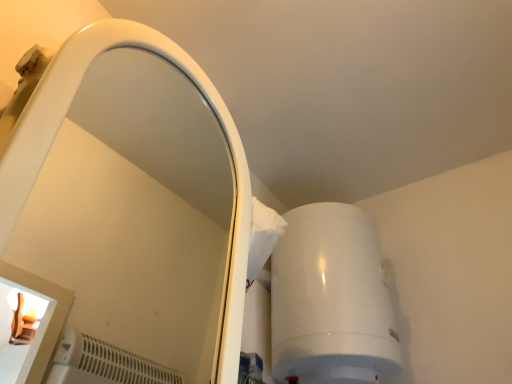
Question: Is white glossy mirror at upper left to the right of white glossy water heater at upper right from the viewer's perspective?

Choices:
 (A) yes
 (B) no

Answer: (B)

Question: Can we say white glossy mirror at upper left lies outside white glossy water heater at upper right?

Choices:
 (A) yes
 (B) no

Answer: (A)

Question: Is white glossy mirror at upper left in contact with white glossy water heater at upper right?

Choices:
 (A) no
 (B) yes

Answer: (A)

Question: Considering the relative sizes of white glossy mirror at upper left and white glossy water heater at upper right in the image provided, is white glossy mirror at upper left shorter than white glossy water heater at upper right?

Choices:
 (A) yes
 (B) no

Answer: (B)

Question: Is white glossy mirror at upper left taller than white glossy water heater at upper right?

Choices:
 (A) no
 (B) yes

Answer: (B)

Question: Is there a large distance between white glossy mirror at upper left and white glossy water heater at upper right?

Choices:
 (A) no
 (B) yes

Answer: (A)

Question: Are white glossy water heater at upper right and white glossy mirror at upper left far apart?

Choices:
 (A) no
 (B) yes

Answer: (A)

Question: Does white glossy water heater at upper right turn towards white glossy mirror at upper left?

Choices:
 (A) no
 (B) yes

Answer: (A)

Question: From the image's perspective, is white glossy water heater at upper right on white glossy mirror at upper left?

Choices:
 (A) no
 (B) yes

Answer: (A)

Question: Does white glossy water heater at upper right have a lesser width compared to white glossy mirror at upper left?

Choices:
 (A) no
 (B) yes

Answer: (A)

Question: Is white glossy water heater at upper right positioned before white glossy mirror at upper left?

Choices:
 (A) no
 (B) yes

Answer: (A)

Question: From a real-world perspective, is white glossy water heater at upper right beneath white glossy mirror at upper left?

Choices:
 (A) yes
 (B) no

Answer: (B)

Question: Considering the relative positions of white glossy mirror at upper left and white glossy water heater at upper right in the image provided, is white glossy mirror at upper left to the left or to the right of white glossy water heater at upper right?

Choices:
 (A) right
 (B) left

Answer: (B)